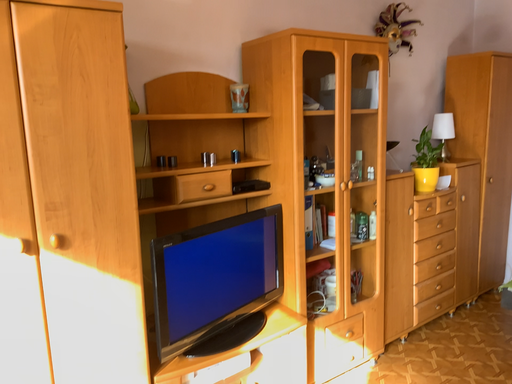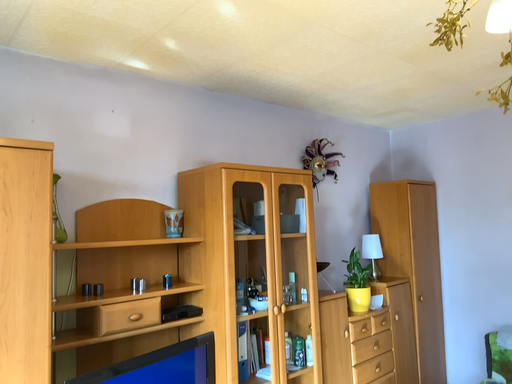
Question: Which way did the camera rotate in the video?

Choices:
 (A) rotated left
 (B) rotated right

Answer: (B)